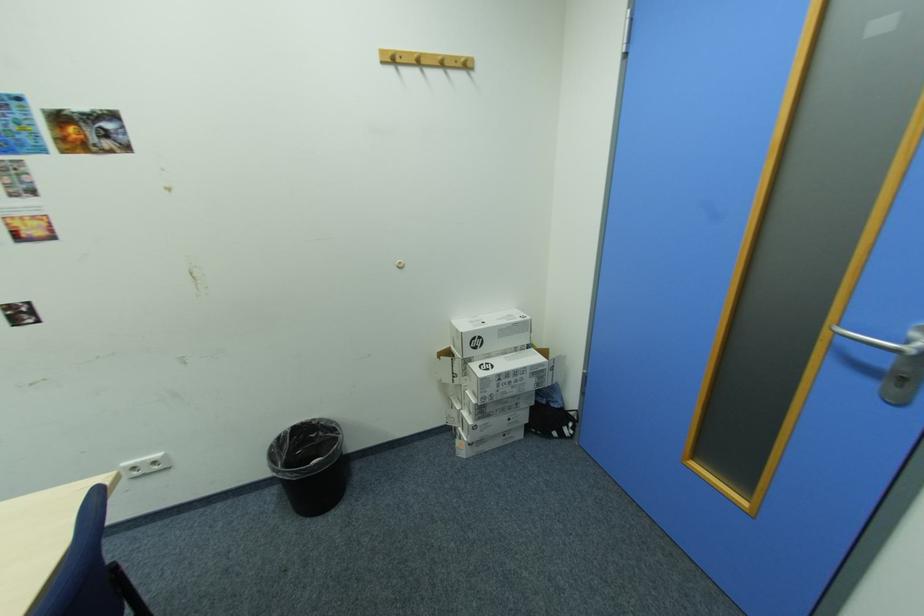
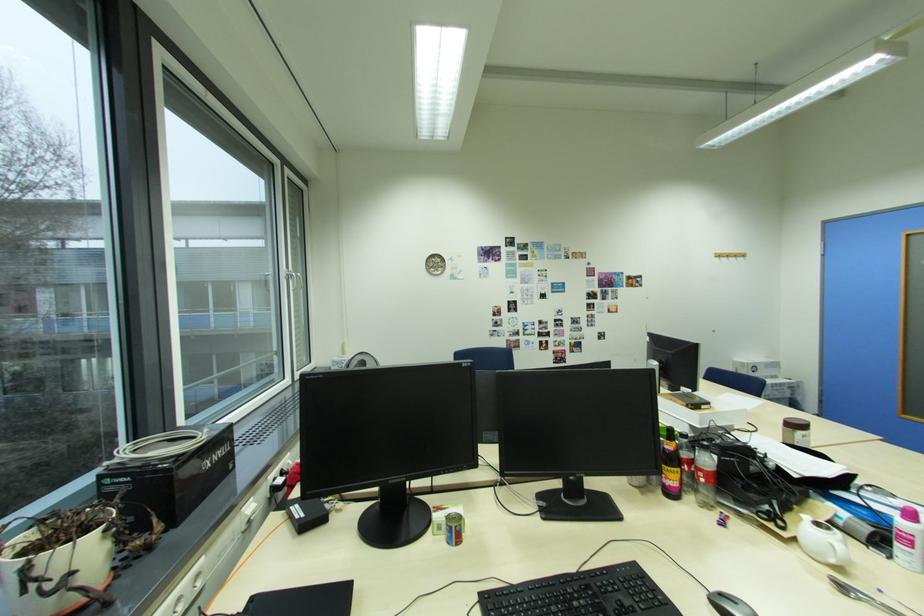
What movement of the cameraman would produce the second image?

The cameraman walked toward left, backward.